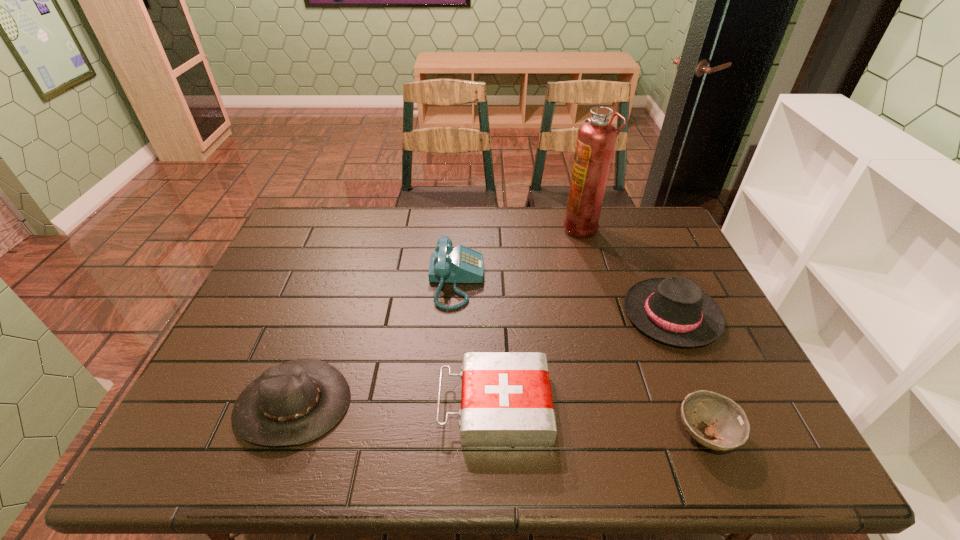
Find the location of a particular element. The width and height of the screenshot is (960, 540). vacant space in between the tallest object and the dress hat is located at coordinates (627, 271).

The height and width of the screenshot is (540, 960). What are the coordinates of `free point between the first-aid kit and the bowl` in the screenshot? It's located at (600, 420).

Locate an element on the screen. This screenshot has height=540, width=960. free space between the first-aid kit and the bowl is located at coordinates (600, 420).

The image size is (960, 540). In order to click on vacant region between the dress hat and the fire extinguisher in this screenshot , I will do `click(627, 271)`.

Locate an element on the screen. This screenshot has height=540, width=960. unoccupied area between the farthest object and the leftmost object is located at coordinates pos(438,315).

Where is `vacant area that lies between the first-aid kit and the leftmost object`? Image resolution: width=960 pixels, height=540 pixels. vacant area that lies between the first-aid kit and the leftmost object is located at coordinates (394, 405).

Where is `free space between the first-aid kit and the bowl`? The image size is (960, 540). free space between the first-aid kit and the bowl is located at coordinates (600, 420).

At what (x,y) coordinates should I click in order to perform the action: click on empty space that is in between the leftmost object and the first-aid kit. Please return your answer as a coordinate pair (x, y). This screenshot has height=540, width=960. Looking at the image, I should click on (394, 405).

Find the location of `free space between the telephone and the hat`. free space between the telephone and the hat is located at coordinates (374, 342).

Choose which object is the fourth nearest neighbor to the telephone. Please provide its 2D coordinates. Your answer should be formatted as a tuple, i.e. [(x, y)], where the tuple contains the x and y coordinates of a point satisfying the conditions above.

[(674, 310)]